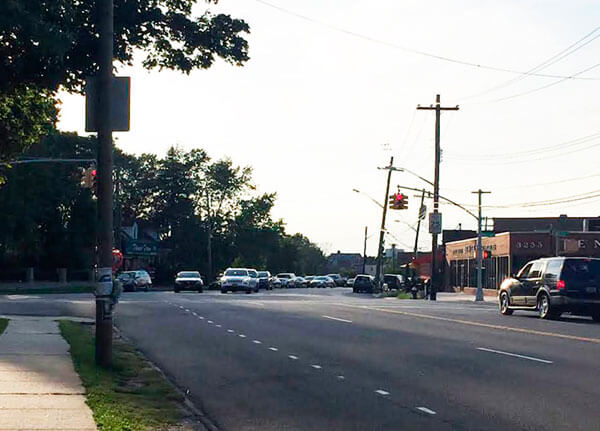
The image size is (600, 431). What are the coordinates of `windows` in the screenshot? It's located at (503, 269), (489, 275), (463, 273).